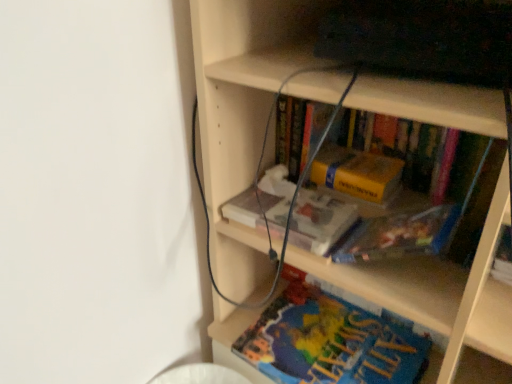
Question: Does yellow matte book at center, positioned as the 1th book in top-to-bottom order, lie in front of wooden bookcase at center?

Choices:
 (A) yes
 (B) no

Answer: (B)

Question: From a real-world perspective, is yellow matte book at center, positioned as the 1th book in top-to-bottom order, physically above wooden bookcase at center?

Choices:
 (A) yes
 (B) no

Answer: (A)

Question: Is yellow matte book at center, which is the 2th book from bottom to top, looking in the opposite direction of wooden bookcase at center?

Choices:
 (A) no
 (B) yes

Answer: (B)

Question: From the image's perspective, does yellow matte book at center, positioned as the 1th book in top-to-bottom order, appear lower than wooden bookcase at center?

Choices:
 (A) no
 (B) yes

Answer: (A)

Question: Is yellow matte book at center, positioned as the 1th book in top-to-bottom order, outside wooden bookcase at center?

Choices:
 (A) no
 (B) yes

Answer: (A)

Question: In terms of width, does blue matte book at lower center, positioned as the 2th book in top-to-bottom order, look wider or thinner when compared to yellow matte book at center, which is the 2th book from bottom to top?

Choices:
 (A) thin
 (B) wide

Answer: (B)

Question: Do you think blue matte book at lower center, which is counted as the 1th book, starting from the bottom, is within yellow matte book at center, which is the 2th book from bottom to top, or outside of it?

Choices:
 (A) outside
 (B) inside

Answer: (A)

Question: In the image, is blue matte book at lower center, which is counted as the 1th book, starting from the bottom, positioned in front of or behind yellow matte book at center, which is the 2th book from bottom to top?

Choices:
 (A) front
 (B) behind

Answer: (A)

Question: From a real-world perspective, relative to yellow matte book at center, which is the 2th book from bottom to top, is blue matte book at lower center, positioned as the 2th book in top-to-bottom order, vertically above or below?

Choices:
 (A) below
 (B) above

Answer: (A)

Question: Considering their positions, is yellow matte paperback book at center located in front of or behind blue matte book at lower center, positioned as the 2th book in top-to-bottom order?

Choices:
 (A) behind
 (B) front

Answer: (A)

Question: From a real-world perspective, is yellow matte paperback book at center above or below blue matte book at lower center, positioned as the 2th book in top-to-bottom order?

Choices:
 (A) below
 (B) above

Answer: (B)

Question: Would you say yellow matte paperback book at center is to the left or to the right of blue matte book at lower center, which is counted as the 1th book, starting from the bottom, in the picture?

Choices:
 (A) left
 (B) right

Answer: (B)

Question: Considering the positions of yellow matte paperback book at center and blue matte book at lower center, positioned as the 2th book in top-to-bottom order, in the image, is yellow matte paperback book at center wider or thinner than blue matte book at lower center, positioned as the 2th book in top-to-bottom order,?

Choices:
 (A) thin
 (B) wide

Answer: (A)

Question: Choose the correct answer: Is blue matte book at lower center, which is counted as the 1th book, starting from the bottom, inside wooden bookcase at center or outside it?

Choices:
 (A) outside
 (B) inside

Answer: (B)

Question: Based on their positions, is blue matte book at lower center, positioned as the 2th book in top-to-bottom order, located to the left or right of wooden bookcase at center?

Choices:
 (A) right
 (B) left

Answer: (B)